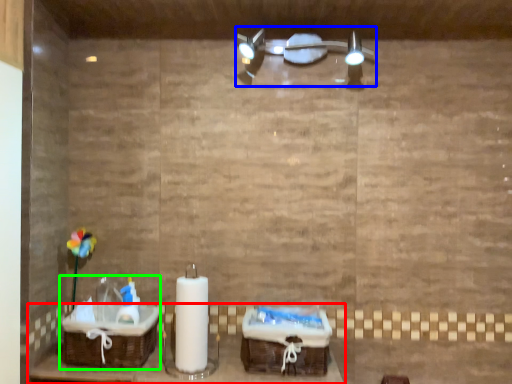
Question: Which object is positioned closest to furniture (highlighted by a red box)? Select from light fixture (highlighted by a blue box) and sink (highlighted by a green box).

Choices:
 (A) light fixture
 (B) sink

Answer: (B)